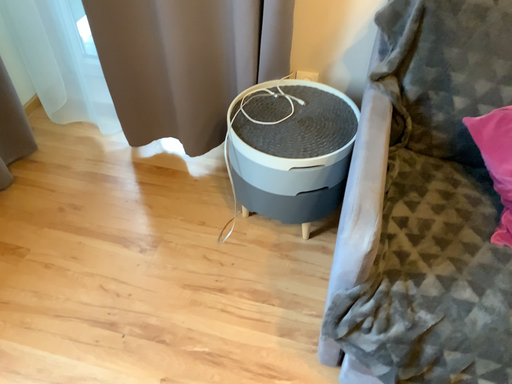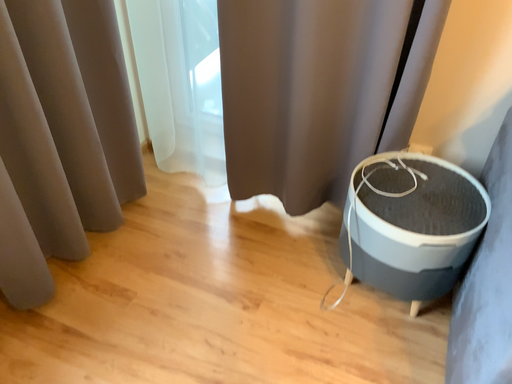
Question: Which way did the camera rotate in the video?

Choices:
 (A) rotated upward
 (B) rotated downward

Answer: (A)